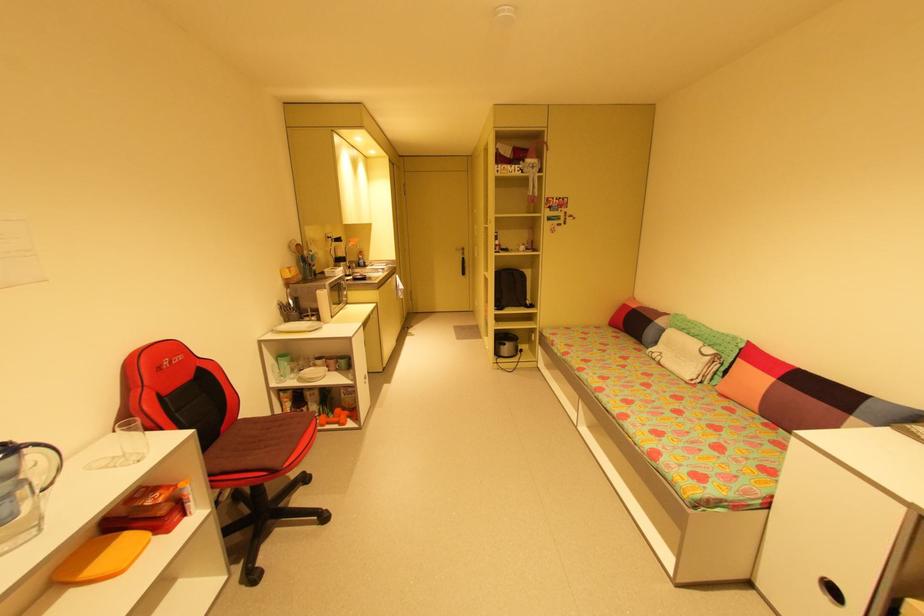
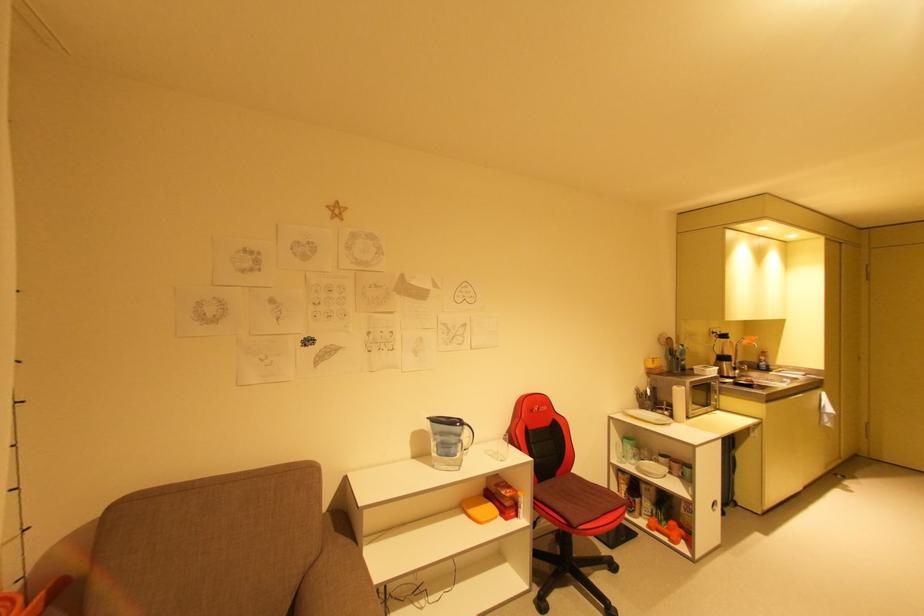
Question: The camera is either moving clockwise (left) or counter-clockwise (right) around the object. The first image is from the beginning of the video and the second image is from the end. Is the camera moving left or right when shooting the video?

Choices:
 (A) Left
 (B) Right

Answer: (B)